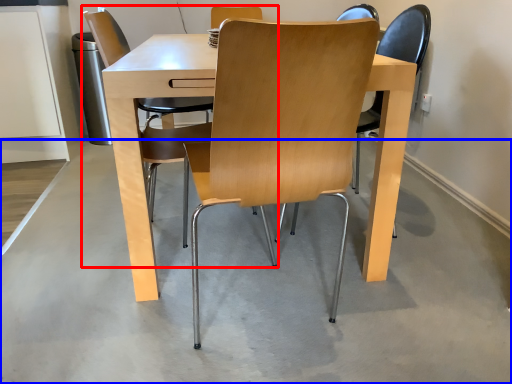
Question: Which object appears closest to the camera in this image, chair (highlighted by a red box) or concrete (highlighted by a blue box)?

Choices:
 (A) chair
 (B) concrete

Answer: (B)